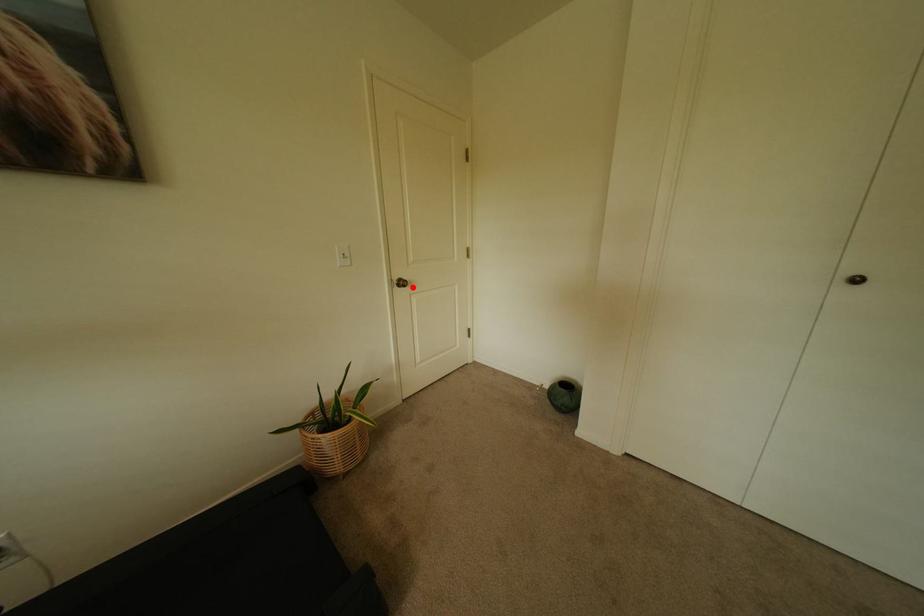
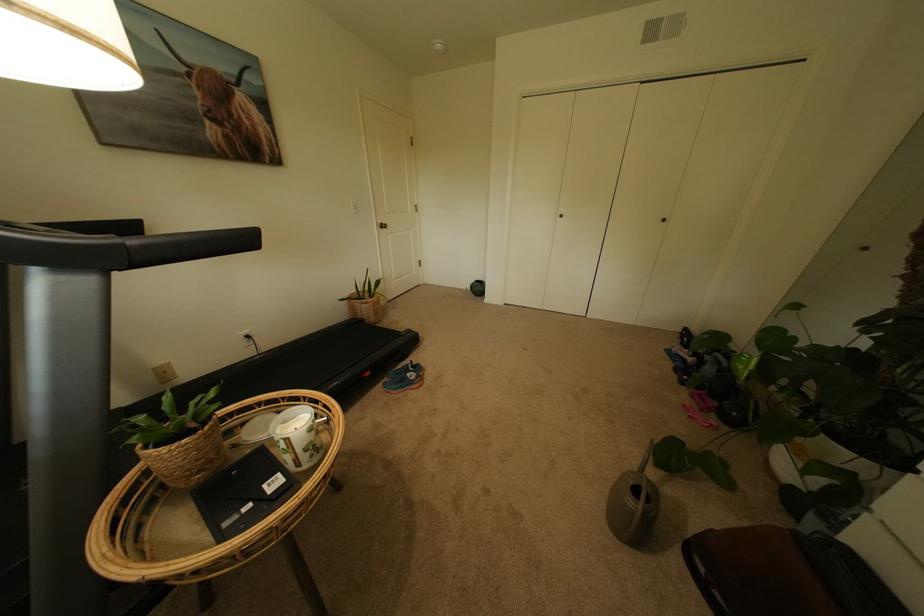
Locate, in the second image, the point that corresponds to the highlighted location in the first image.

(394, 229)